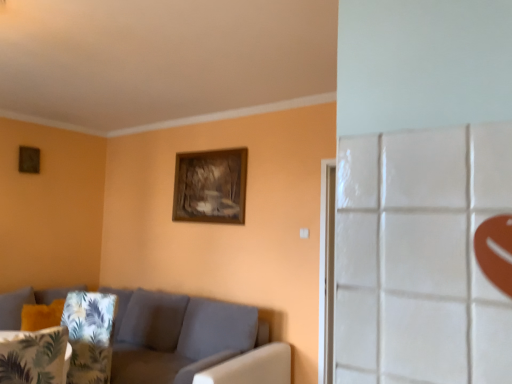
Question: Considering the positions of point (198, 178) and point (53, 362), is point (198, 178) closer or farther from the camera than point (53, 362)?

Choices:
 (A) farther
 (B) closer

Answer: (A)

Question: From the image's perspective, is wooden frame at upper center positioned above or below green leafy fabric pillow at lower left?

Choices:
 (A) above
 (B) below

Answer: (A)

Question: Estimate the real-world distances between objects in this image. Which object is farther from the wooden frame at upper center?

Choices:
 (A) green leafy fabric pillow at lower left
 (B) fabric couch at lower left

Answer: (A)

Question: Considering the real-world distances, which object is closest to the wooden frame at upper center?

Choices:
 (A) fabric couch at lower left
 (B) green leafy fabric pillow at lower left

Answer: (A)